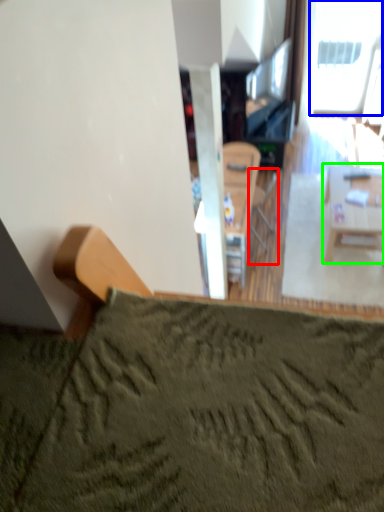
Question: Which is farther away from armchair (highlighted by a red box)? window (highlighted by a blue box) or table (highlighted by a green box)?

Choices:
 (A) window
 (B) table

Answer: (A)